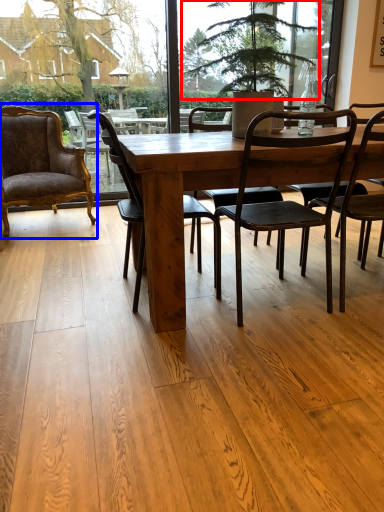
Question: Among these objects, which one is farthest to the camera, tree (highlighted by a red box) or chair (highlighted by a blue box)?

Choices:
 (A) tree
 (B) chair

Answer: (B)